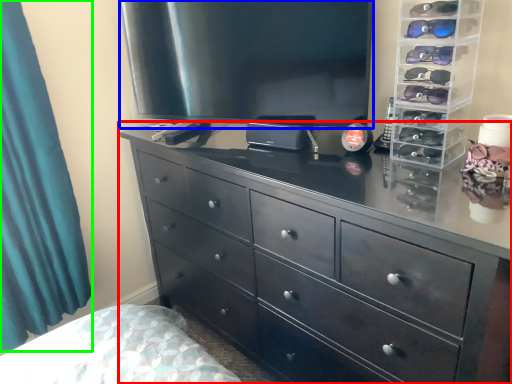
Question: Considering the real-world distances, which object is farthest from chest of drawers (highlighted by a red box)? television (highlighted by a blue box) or curtain (highlighted by a green box)?

Choices:
 (A) television
 (B) curtain

Answer: (B)